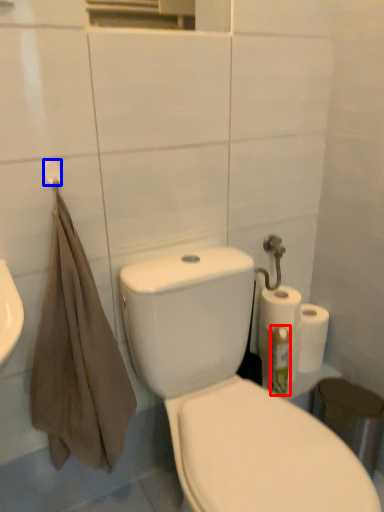
Question: Among these objects, which one is farthest to the camera, cleaning product (highlighted by a red box) or towel bar (highlighted by a blue box)?

Choices:
 (A) cleaning product
 (B) towel bar

Answer: (A)